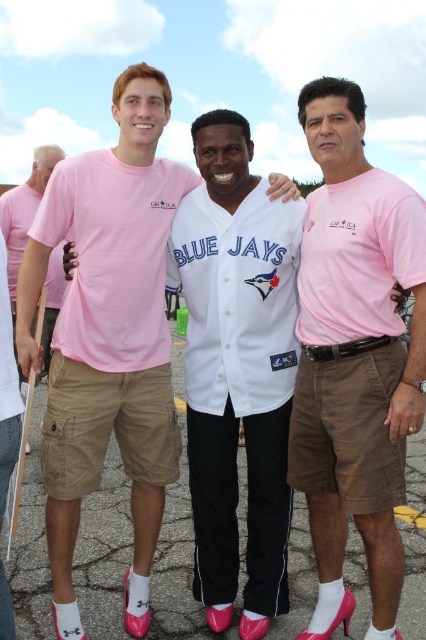
Question: Which is nearer to the matte pink t-shirt at left?

Choices:
 (A) white jersey at center
 (B) pink cotton shirt at right

Answer: (A)

Question: Can you confirm if pink cotton shirt at right is thinner than white jersey at center?

Choices:
 (A) yes
 (B) no

Answer: (A)

Question: Which point is closer to the camera taking this photo?

Choices:
 (A) (43, 154)
 (B) (314, 508)
 (C) (267, 452)

Answer: (B)

Question: Does white jersey at center appear on the right side of matte pink t-shirt at left?

Choices:
 (A) no
 (B) yes

Answer: (B)

Question: Which is nearer to the matte pink t-shirt at left?

Choices:
 (A) white jersey at center
 (B) pink cotton shirt at right

Answer: (A)

Question: Does pink cotton shirt at right appear on the left side of matte pink t-shirt at left?

Choices:
 (A) yes
 (B) no

Answer: (B)